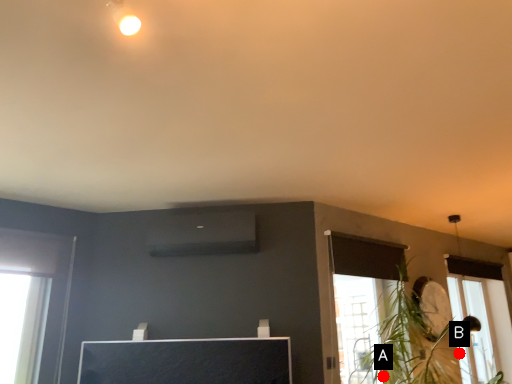
Question: Two points are circled on the image, labeled by A and B beside each circle. Which of the following is the farthest from the observer?

Choices:
 (A) A is further
 (B) B is further

Answer: (B)